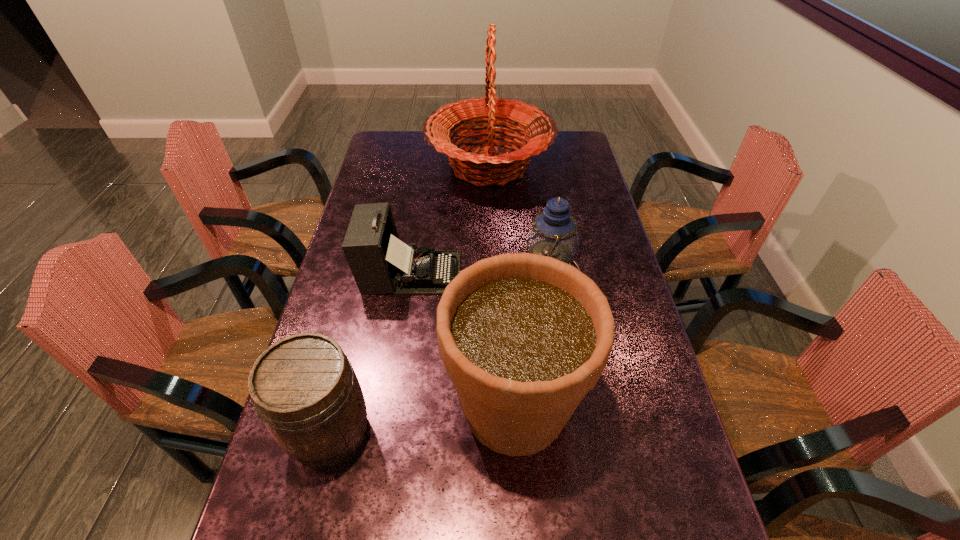
The height and width of the screenshot is (540, 960). In the image, there is a desktop. Identify the location of vacant space at the right edge. (633, 521).

Where is `free spot between the tallest object and the lantern`? This screenshot has width=960, height=540. free spot between the tallest object and the lantern is located at coordinates (518, 219).

What are the coordinates of `vacant area between the cider and the shortest object` in the screenshot? It's located at (371, 353).

Where is `unoccupied area between the typewriter and the tallest object`? unoccupied area between the typewriter and the tallest object is located at coordinates [x=450, y=219].

Locate an element on the screen. The image size is (960, 540). free spot between the tallest object and the cider is located at coordinates (410, 299).

Image resolution: width=960 pixels, height=540 pixels. What are the coordinates of `free area in between the flowerpot and the cider` in the screenshot? It's located at (422, 420).

This screenshot has height=540, width=960. Find the location of `the fourth closest object relative to the lantern`. the fourth closest object relative to the lantern is located at coordinates (305, 390).

Locate an element on the screen. The height and width of the screenshot is (540, 960). the fourth closest object relative to the tallest object is located at coordinates (305, 390).

You are a GUI agent. You are given a task and a screenshot of the screen. Output one action in this format:
    pyautogui.click(x=<x>, y=<y>)
    Task: Click on the vacant area in the image that satisfies the following two spatial constraints: 1. inside the open case of the flowerpot; 2. on the right side of the shortest object
    
    Given the screenshot: What is the action you would take?
    pyautogui.click(x=391, y=407)

Locate an element on the screen. blank space that satisfies the following two spatial constraints: 1. on the front side of the basket; 2. on the side of the cider near the bung hole is located at coordinates (x=496, y=433).